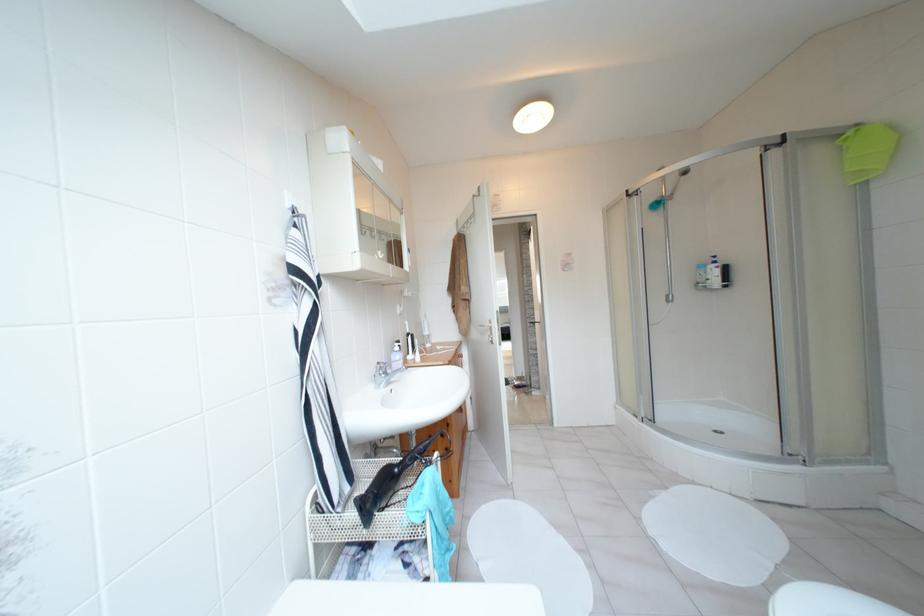
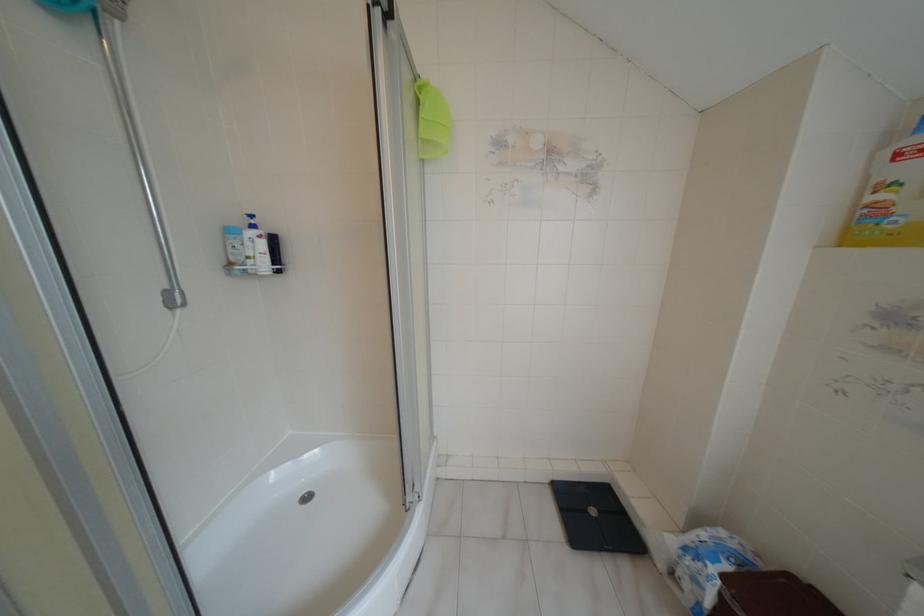
Question: I am providing you with two images of the same scene from different viewpoints. Please identify which objects are invisible in image2.

Choices:
 (A) green hanging scrubber
 (B) blue bottle pump
 (C) light blue bottle
 (D) none of these

Answer: (D)